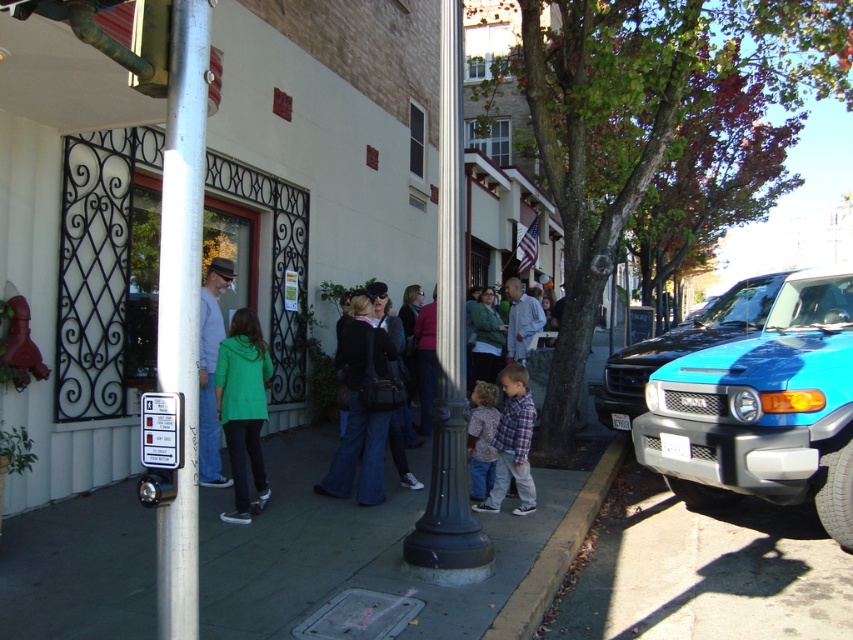
Question: Considering the relative positions of brown concrete curb at lower right and denim jacket at center in the image provided, where is brown concrete curb at lower right located with respect to denim jacket at center?

Choices:
 (A) right
 (B) left

Answer: (A)

Question: Does gray concrete sidewalk at center appear under denim jacket at center?

Choices:
 (A) yes
 (B) no

Answer: (A)

Question: Which object appears farthest from the camera in this image?

Choices:
 (A) gray concrete sidewalk at center
 (B) silver metallic pole at center

Answer: (A)

Question: Among these objects, which one is nearest to the camera?

Choices:
 (A) black metal pole at center
 (B) denim jacket at center
 (C) plaid shirt at center

Answer: (A)

Question: Is green matte jacket at center to the left of plaid shirt at center from the viewer's perspective?

Choices:
 (A) no
 (B) yes

Answer: (B)

Question: Among these objects, which one is nearest to the camera?

Choices:
 (A) plaid shirt at center
 (B) gray concrete sidewalk at center
 (C) blue glossy suv at right
 (D) brown concrete curb at lower right

Answer: (D)